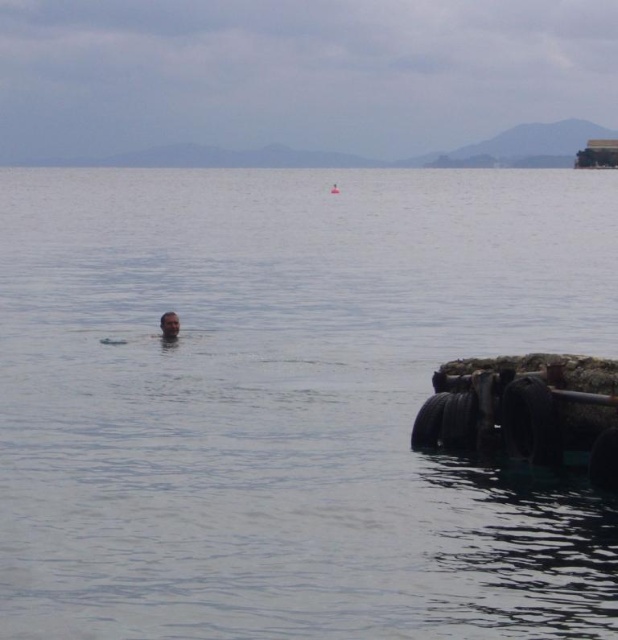
Question: Does transparent water at center have a greater width compared to smooth skin person at center?

Choices:
 (A) yes
 (B) no

Answer: (A)

Question: From the image, what is the correct spatial relationship of rusty metal boat at lower right in relation to smooth skin head at center?

Choices:
 (A) left
 (B) right

Answer: (B)

Question: Which of the following is the farthest from the observer?

Choices:
 (A) smooth skin person at center
 (B) smooth skin head at center
 (C) transparent water at center
 (D) rusty metal boat at lower right

Answer: (A)

Question: Can you confirm if rusty metal boat at lower right is thinner than smooth skin person at center?

Choices:
 (A) no
 (B) yes

Answer: (A)

Question: Which object is closer to the camera taking this photo?

Choices:
 (A) smooth skin person at center
 (B) rusty metal boat at lower right

Answer: (B)

Question: Estimate the real-world distances between objects in this image. Which object is farther from the transparent water at center?

Choices:
 (A) smooth skin head at center
 (B) smooth skin person at center
 (C) rusty metal boat at lower right

Answer: (A)